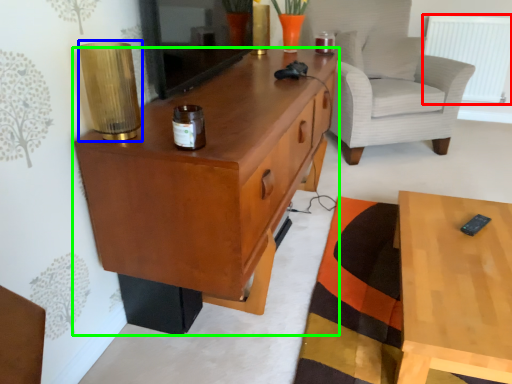
Question: Which object is positioned farthest from radiator (highlighted by a red box)? Select from lamp (highlighted by a blue box) and cabinetry (highlighted by a green box).

Choices:
 (A) lamp
 (B) cabinetry

Answer: (A)